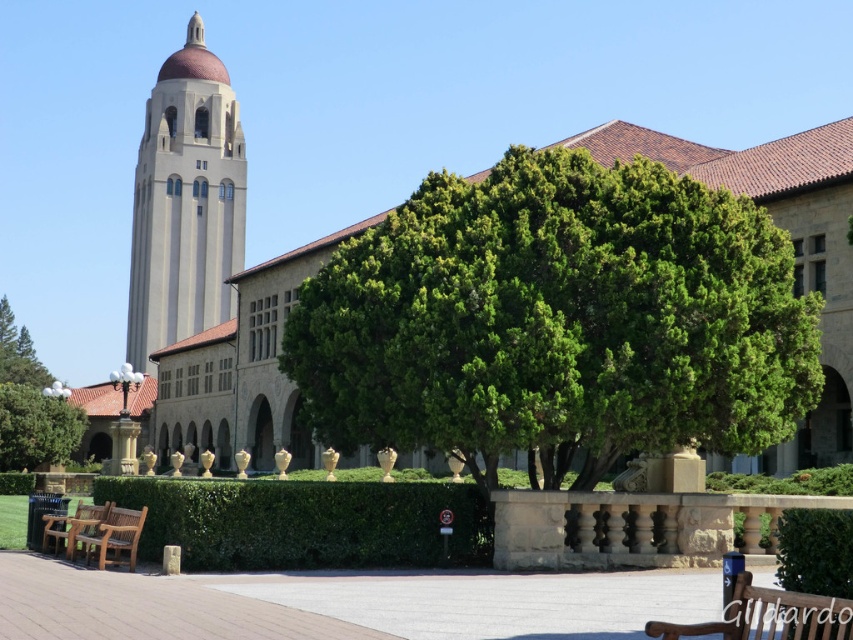
Which is more to the left, green leafy hedge at center or teak wood bench at lower left?

teak wood bench at lower left is more to the left.

You are a GUI agent. You are given a task and a screenshot of the screen. Output one action in this format:
    pyautogui.click(x=<x>, y=<y>)
    Task: Click on the green leafy hedge at center
    Image resolution: width=853 pixels, height=640 pixels.
    Given the screenshot: What is the action you would take?
    pyautogui.click(x=305, y=522)

Can you confirm if green leafy tree at center is positioned below green leafy tree at lower left?

Actually, green leafy tree at center is above green leafy tree at lower left.

Between point (573, 202) and point (0, 456), which one is positioned in front?

Positioned in front is point (573, 202).

Is point (650, 275) positioned before point (22, 419)?

That is True.

At what (x,y) coordinates should I click in order to perform the action: click on green leafy tree at center. Please return your answer as a coordinate pair (x, y). The height and width of the screenshot is (640, 853). Looking at the image, I should click on (556, 321).

How far apart are brown wooden bench at lower right and green leafy tree at lower left?

The distance of brown wooden bench at lower right from green leafy tree at lower left is 67.75 meters.

Is brown wooden bench at lower right thinner than green leafy tree at lower left?

Indeed, brown wooden bench at lower right has a lesser width compared to green leafy tree at lower left.

Is point (769, 600) farther from viewer compared to point (22, 436)?

No, (769, 600) is in front of (22, 436).

You are a GUI agent. You are given a task and a screenshot of the screen. Output one action in this format:
    pyautogui.click(x=<x>, y=<y>)
    Task: Click on the brown wooden bench at lower right
    
    Given the screenshot: What is the action you would take?
    pyautogui.click(x=769, y=616)